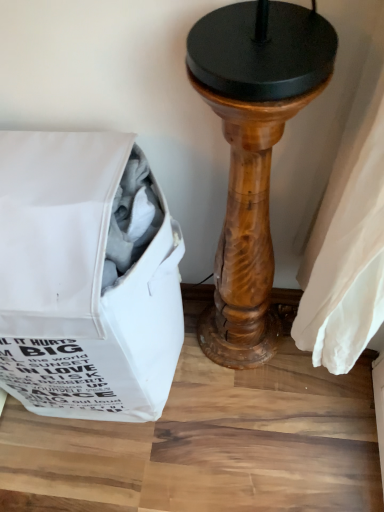
Question: Can you confirm if wooden pedestal at center is positioned to the right of white fabric bag at left?

Choices:
 (A) no
 (B) yes

Answer: (B)

Question: Is wooden pedestal at center turned away from white fabric bag at left?

Choices:
 (A) yes
 (B) no

Answer: (B)

Question: Is wooden pedestal at center thinner than white fabric bag at left?

Choices:
 (A) no
 (B) yes

Answer: (B)

Question: Is wooden pedestal at center smaller than white fabric bag at left?

Choices:
 (A) no
 (B) yes

Answer: (B)

Question: From the image's perspective, is wooden pedestal at center below white fabric bag at left?

Choices:
 (A) yes
 (B) no

Answer: (B)

Question: Is white fabric bag at left located within wooden pedestal at center?

Choices:
 (A) yes
 (B) no

Answer: (B)

Question: Is white fabric bag at left not within wooden pedestal at center?

Choices:
 (A) no
 (B) yes

Answer: (B)

Question: Is white fabric bag at left taller than wooden pedestal at center?

Choices:
 (A) no
 (B) yes

Answer: (A)

Question: From the image's perspective, is white fabric bag at left on wooden pedestal at center?

Choices:
 (A) yes
 (B) no

Answer: (B)

Question: Considering the relative sizes of white fabric bag at left and wooden pedestal at center in the image provided, is white fabric bag at left wider than wooden pedestal at center?

Choices:
 (A) yes
 (B) no

Answer: (A)

Question: Considering the relative positions of white fabric bag at left and wooden pedestal at center in the image provided, is white fabric bag at left in front of wooden pedestal at center?

Choices:
 (A) no
 (B) yes

Answer: (A)

Question: Are white fabric bag at left and wooden pedestal at center far apart?

Choices:
 (A) no
 (B) yes

Answer: (A)

Question: In terms of height, does wooden pedestal at center look taller or shorter compared to white fabric bag at left?

Choices:
 (A) short
 (B) tall

Answer: (B)